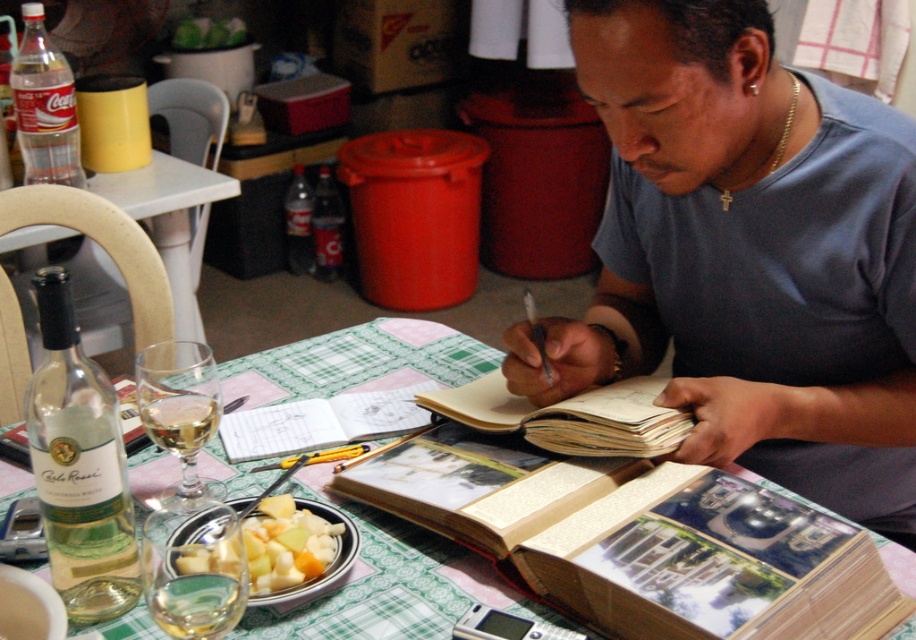
Question: Does clear glass wine glass at table left appear under translucent glass wine at lower left?

Choices:
 (A) yes
 (B) no

Answer: (B)

Question: Considering the relative positions of gray cotton shirt at center and clear glass soda bottle at center in the image provided, where is gray cotton shirt at center located with respect to clear glass soda bottle at center?

Choices:
 (A) right
 (B) left

Answer: (A)

Question: Which object is farther from the camera taking this photo?

Choices:
 (A) clear glass wine at center
 (B) clear glass wine glass at lower left

Answer: (A)

Question: Does clear glass wine glass at lower left have a lesser width compared to translucent glass wine at lower left?

Choices:
 (A) no
 (B) yes

Answer: (A)

Question: Which point appears closest to the camera in this image?

Choices:
 (A) (96, 390)
 (B) (631, 387)
 (C) (139, 397)
 (D) (342, 256)

Answer: (A)

Question: Which point is closer to the camera?

Choices:
 (A) light brown paper notebook at center
 (B) clear glass wine at center
 (C) green fabric table at lower left
 (D) translucent plastic bottle at upper left

Answer: (B)